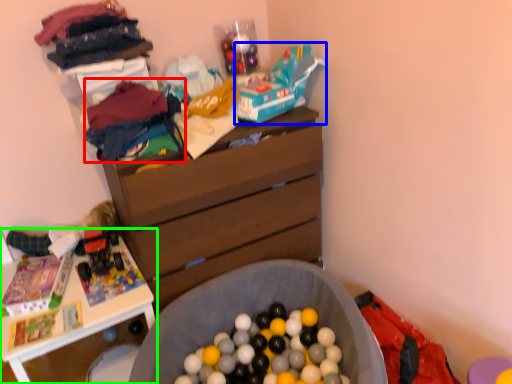
Question: Based on their relative distances, which object is nearer to clothing (highlighted by a red box)? Choose from toy car (highlighted by a blue box) and table (highlighted by a green box).

Choices:
 (A) toy car
 (B) table

Answer: (A)